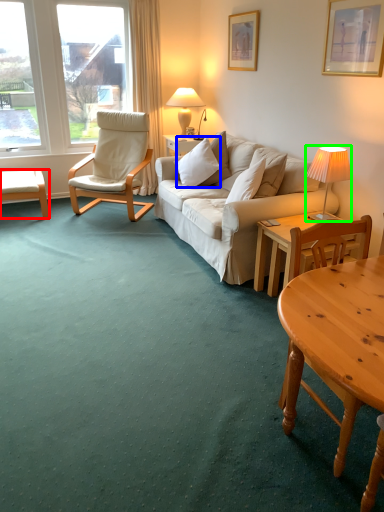
Question: Estimate the real-world distances between objects in this image. Which object is farther from desk (highlighted by a red box), pillow (highlighted by a blue box) or lamp (highlighted by a green box)?

Choices:
 (A) pillow
 (B) lamp

Answer: (B)